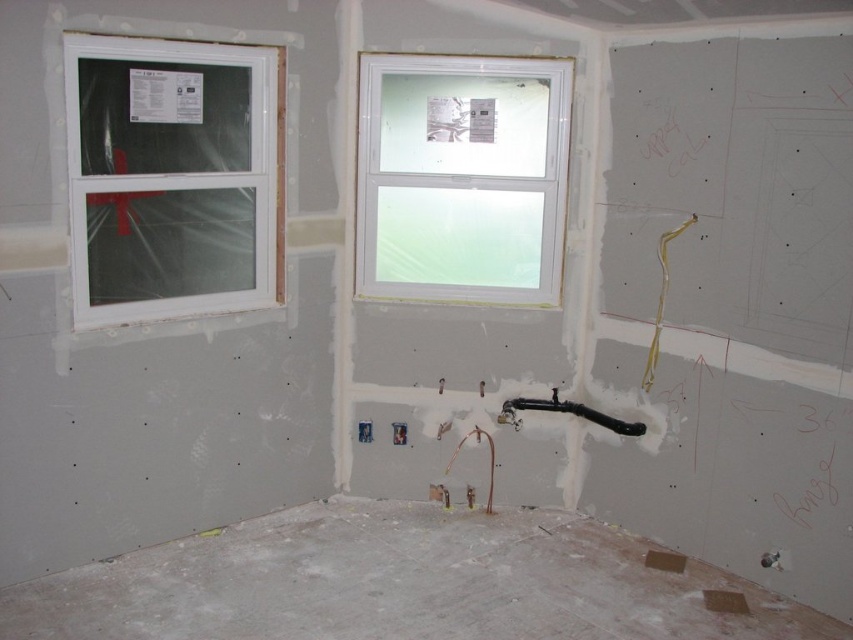
You are an architect inspecting the construction site. You notice a point at coordinates (173,177). Based on the scene description, what object is located at that point?

The point at coordinates (173,177) corresponds to the white plastic window at left.

You are a contractor inspecting the construction site. You need to access the black rubber pipe at center to make repairs. Can you reach it without moving the white plastic window at left?

The white plastic window at left is located above the black rubber pipe at center, so you can reach the black rubber pipe at center without needing to move the window.

Based on the photo, you are an inspector checking the construction site. You notice two white plastic windows. Which one is closer to you, the white plastic window at left or the white plastic window at upper center?

The white plastic window at left is closer to you because it is in front of the white plastic window at upper center.